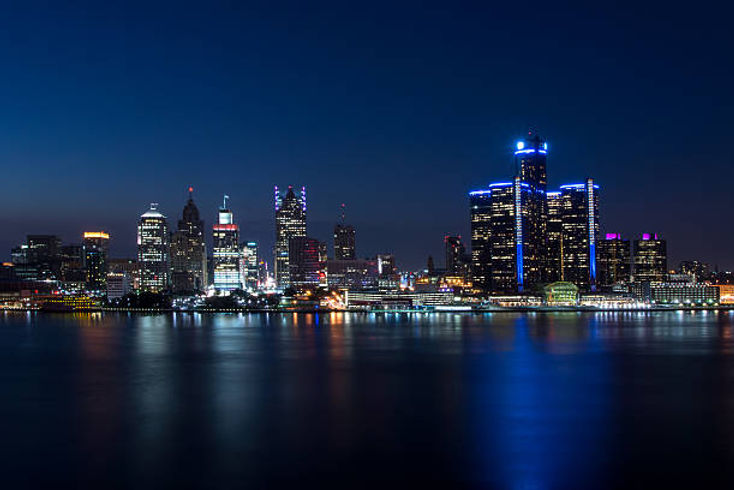
At what (x,y) coordinates should I click in order to perform the action: click on vertical row of lights. Please return your answer as a coordinate pair (x, y). Looking at the image, I should click on (519, 225), (595, 223).